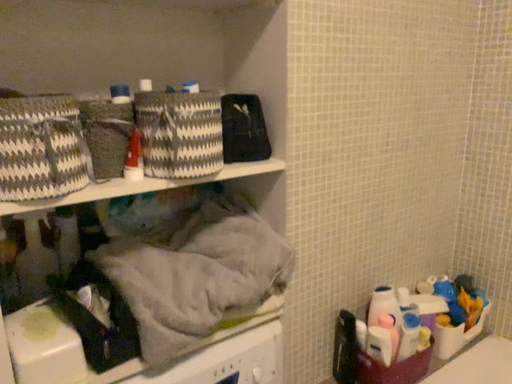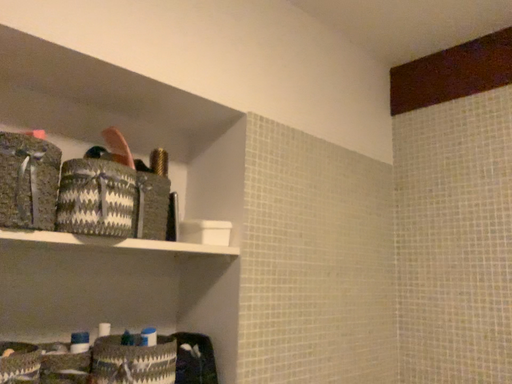
Question: How did the camera likely rotate when shooting the video?

Choices:
 (A) rotated downward
 (B) rotated upward

Answer: (B)